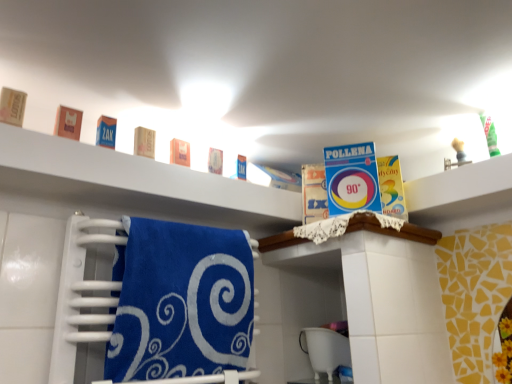
Question: Should I look upward or downward to see white plastic bucket at lower center?

Choices:
 (A) down
 (B) up

Answer: (A)

Question: Considering the relative sizes of matte brown soap at left, the first product when ordered from left to right, and blue cardboard box at upper left, the fifth product in the right-to-left sequence, in the image provided, is matte brown soap at left, the first product when ordered from left to right, thinner than blue cardboard box at upper left, the fifth product in the right-to-left sequence,?

Choices:
 (A) no
 (B) yes

Answer: (B)

Question: Is matte brown soap at left, the 7th product from the right, not close to blue cardboard box at upper left, which is the third product from left to right?

Choices:
 (A) yes
 (B) no

Answer: (B)

Question: Considering the relative positions of matte brown soap at left, the 7th product from the right, and blue cardboard box at upper left, which is the third product from left to right, in the image provided, is matte brown soap at left, the 7th product from the right, to the right of blue cardboard box at upper left, which is the third product from left to right, from the viewer's perspective?

Choices:
 (A) no
 (B) yes

Answer: (A)

Question: Is matte brown soap at left, the first product when ordered from left to right, shorter than blue cardboard box at upper left, the fifth product in the right-to-left sequence?

Choices:
 (A) no
 (B) yes

Answer: (A)

Question: Is blue cardboard box at upper left, which is the third product from left to right, a part of matte brown soap at left, the 7th product from the right?

Choices:
 (A) yes
 (B) no

Answer: (B)

Question: Considering the relative sizes of matte brown soap at left, the first product when ordered from left to right, and blue cardboard box at upper left, the fifth product in the right-to-left sequence, in the image provided, is matte brown soap at left, the first product when ordered from left to right, bigger than blue cardboard box at upper left, the fifth product in the right-to-left sequence,?

Choices:
 (A) yes
 (B) no

Answer: (A)

Question: From a real-world perspective, does satin blue towel at lower left sit lower than blue cardboard box at upper left, the fifth product in the right-to-left sequence?

Choices:
 (A) no
 (B) yes

Answer: (B)

Question: Considering the relative sizes of satin blue towel at lower left and blue cardboard box at upper left, which is the third product from left to right, in the image provided, is satin blue towel at lower left bigger than blue cardboard box at upper left, which is the third product from left to right,?

Choices:
 (A) no
 (B) yes

Answer: (B)

Question: Considering the relative sizes of satin blue towel at lower left and blue cardboard box at upper left, the fifth product in the right-to-left sequence, in the image provided, is satin blue towel at lower left smaller than blue cardboard box at upper left, the fifth product in the right-to-left sequence,?

Choices:
 (A) yes
 (B) no

Answer: (B)

Question: Is satin blue towel at lower left taller than blue cardboard box at upper left, which is the third product from left to right?

Choices:
 (A) no
 (B) yes

Answer: (B)

Question: Could blue cardboard box at upper left, which is the third product from left to right, be considered to be inside satin blue towel at lower left?

Choices:
 (A) no
 (B) yes

Answer: (A)

Question: Are satin blue towel at lower left and blue cardboard box at upper left, which is the third product from left to right, beside each other?

Choices:
 (A) no
 (B) yes

Answer: (A)

Question: From the image's perspective, is satin blue towel at lower left located above matte brown soap at left, the first product when ordered from left to right?

Choices:
 (A) yes
 (B) no

Answer: (B)